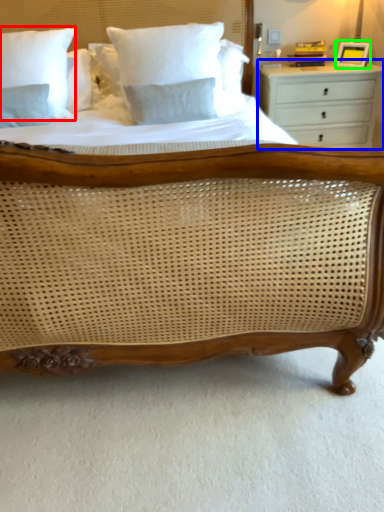
Question: Which object is positioned closest to pillow (highlighted by a red box)? Select from chest of drawers (highlighted by a blue box) and picture frame (highlighted by a green box).

Choices:
 (A) chest of drawers
 (B) picture frame

Answer: (A)